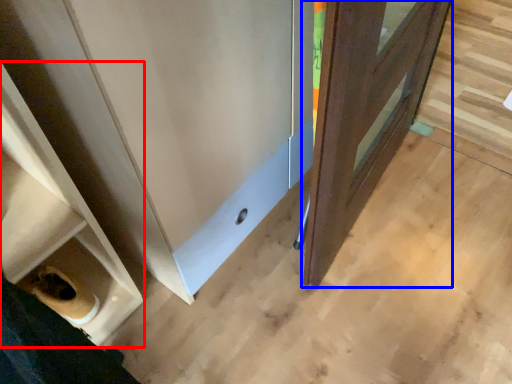
Question: Which point is further to the camera, shelf (highlighted by a red box) or door (highlighted by a blue box)?

Choices:
 (A) shelf
 (B) door

Answer: (B)